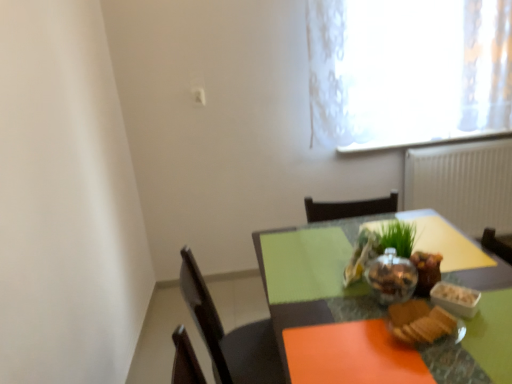
I want to click on free location in front of slightly toasted bread at lower right, acting as the third food starting from the back, so click(453, 364).